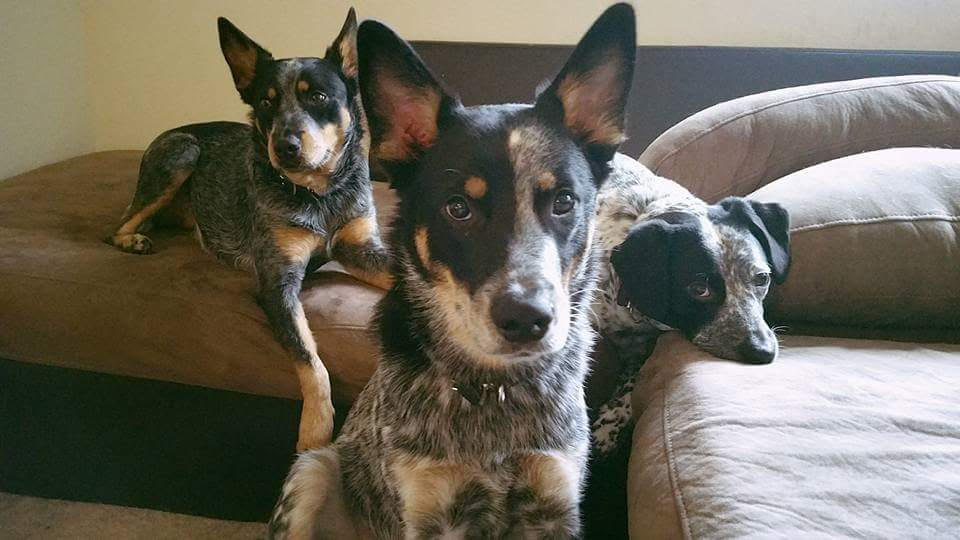
You are a GUI agent. You are given a task and a screenshot of the screen. Output one action in this format:
    pyautogui.click(x=<x>, y=<y>)
    Task: Click on the dark beige/brown carpet
    Image resolution: width=960 pixels, height=540 pixels.
    Given the screenshot: What is the action you would take?
    pyautogui.click(x=74, y=508)